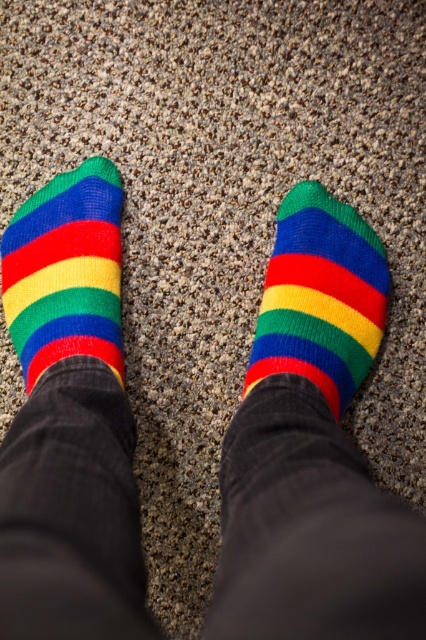
Does knitted woolen sock at center appear on the right side of knitted wool socks at left?

Correct, you'll find knitted woolen sock at center to the right of knitted wool socks at left.

Between knitted woolen sock at center and knitted wool socks at left, which one appears on the right side from the viewer's perspective?

knitted woolen sock at center

Is point (354, 387) positioned in front of point (118, 221)?

Yes, it is in front of point (118, 221).

Locate an element on the screen. knitted woolen sock at center is located at coordinates (321, 296).